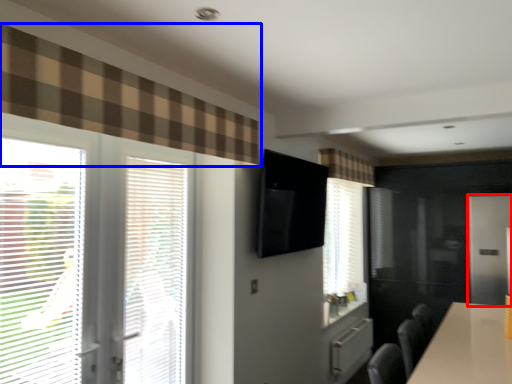
Question: Which object appears closest to the camera in this image, screen door (highlighted by a red box) or curtain (highlighted by a blue box)?

Choices:
 (A) screen door
 (B) curtain

Answer: (B)